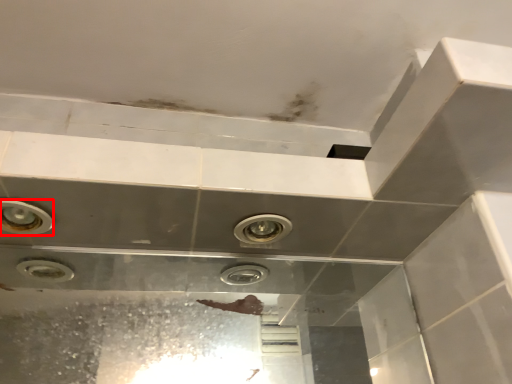
Question: From the image's perspective, considering the relative positions of bubble (annotated by the red box) and plumbing fixture in the image provided, where is bubble (annotated by the red box) located with respect to the staircase?

Choices:
 (A) above
 (B) below

Answer: (A)